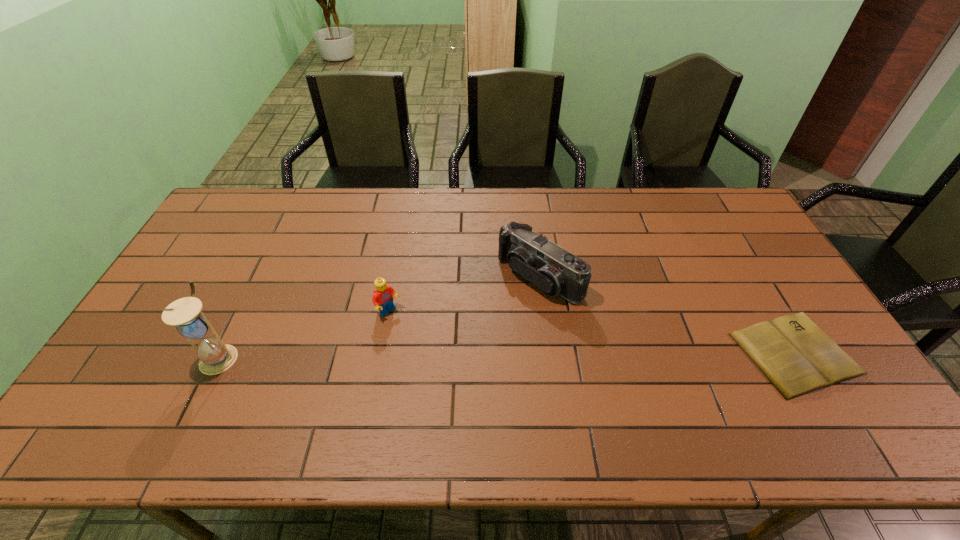
Image resolution: width=960 pixels, height=540 pixels. In order to click on vacant region at the near edge in this screenshot , I will do click(447, 399).

In the image, there is a desktop. At what (x,y) coordinates should I click in order to perform the action: click on free space at the left edge. Please return your answer as a coordinate pair (x, y). This screenshot has height=540, width=960. Looking at the image, I should click on (198, 266).

The height and width of the screenshot is (540, 960). I want to click on free region at the near left corner, so click(128, 373).

Where is `free space between the second object from right to left and the tallest object`? The height and width of the screenshot is (540, 960). free space between the second object from right to left and the tallest object is located at coordinates (379, 316).

Where is `free space between the shortest object and the hourglass`? free space between the shortest object and the hourglass is located at coordinates (508, 355).

Where is `free space between the Lego and the leftmost object`? free space between the Lego and the leftmost object is located at coordinates (304, 334).

You are a GUI agent. You are given a task and a screenshot of the screen. Output one action in this format:
    pyautogui.click(x=<x>, y=<y>)
    Task: Click on the empty space that is in between the rightmost object and the tallest object
    The image size is (960, 540).
    Given the screenshot: What is the action you would take?
    pyautogui.click(x=508, y=355)

Identify the location of free space between the book and the second object from right to left. This screenshot has width=960, height=540. (667, 315).

Where is `free space between the book and the hourglass`? The height and width of the screenshot is (540, 960). free space between the book and the hourglass is located at coordinates (508, 355).

Locate an element on the screen. This screenshot has width=960, height=540. unoccupied area between the third object from right to left and the shortest object is located at coordinates (592, 333).